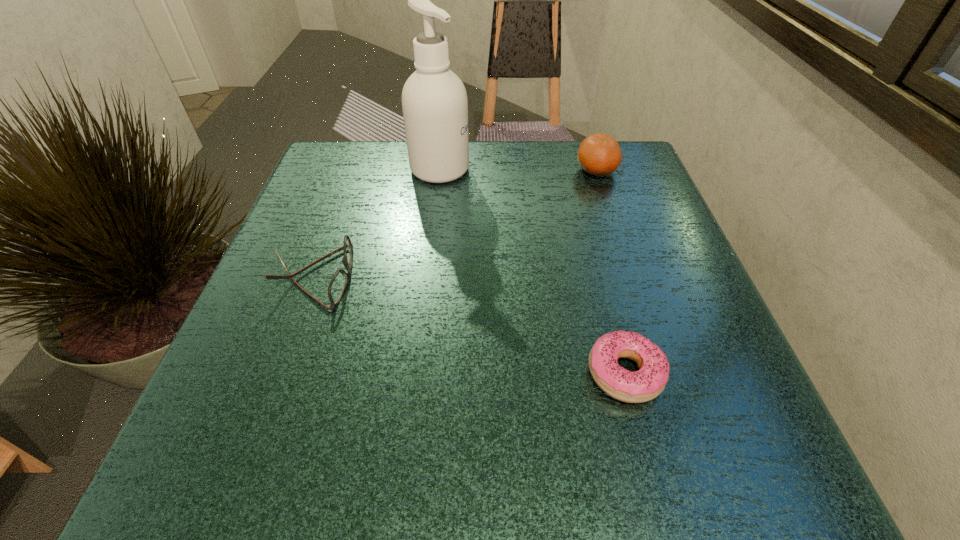
Where is `free space between the second nearest object and the tallest object`? The image size is (960, 540). free space between the second nearest object and the tallest object is located at coordinates (376, 223).

Where is `free space between the clementine and the doughnut`? The image size is (960, 540). free space between the clementine and the doughnut is located at coordinates (611, 272).

What are the coordinates of `unoccupied position between the second tallest object and the third farthest object` in the screenshot? It's located at (455, 224).

What are the coordinates of `the third closest object to the clementine` in the screenshot? It's located at (338, 283).

Identify which object is located as the third nearest to the second tallest object. Please provide its 2D coordinates. Your answer should be formatted as a tuple, i.e. [(x, y)], where the tuple contains the x and y coordinates of a point satisfying the conditions above.

[(338, 283)]

You are a GUI agent. You are given a task and a screenshot of the screen. Output one action in this format:
    pyautogui.click(x=<x>, y=<y>)
    Task: Click on the vacant space that satisfies the following two spatial constraints: 1. on the front-facing side of the second nearest object; 2. on the right side of the doughnut
    
    Given the screenshot: What is the action you would take?
    pyautogui.click(x=278, y=373)

This screenshot has width=960, height=540. Identify the location of free space that satisfies the following two spatial constraints: 1. on the front label of the tallest object; 2. on the left side of the clementine. (440, 170).

Identify the location of vacant space that satisfies the following two spatial constraints: 1. on the front-facing side of the second nearest object; 2. on the right side of the nearest object. (278, 373).

Where is `free spot that satisfies the following two spatial constraints: 1. on the front-facing side of the nearest object; 2. on the left side of the leftmost object`? free spot that satisfies the following two spatial constraints: 1. on the front-facing side of the nearest object; 2. on the left side of the leftmost object is located at coordinates (278, 373).

You are a GUI agent. You are given a task and a screenshot of the screen. Output one action in this format:
    pyautogui.click(x=<x>, y=<y>)
    Task: Click on the free space that satisfies the following two spatial constraints: 1. on the front label of the doughnut; 2. on the left side of the tallest object
    
    Given the screenshot: What is the action you would take?
    pyautogui.click(x=417, y=373)